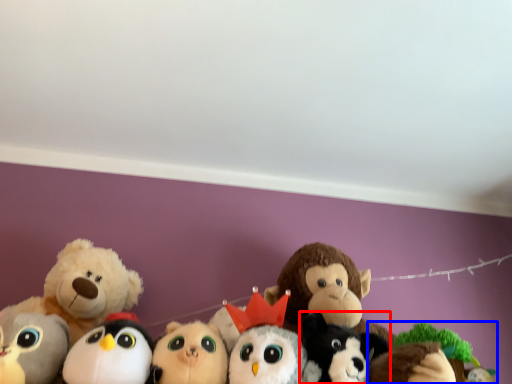
Question: Which point is further to the camera, toy (highlighted by a red box) or toy (highlighted by a blue box)?

Choices:
 (A) toy
 (B) toy

Answer: (B)